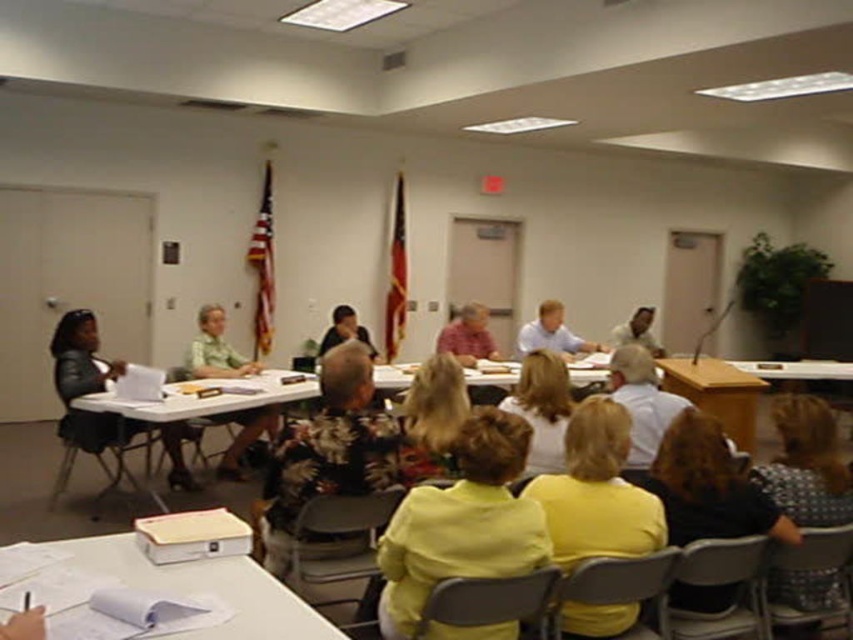
Is matte plastic chair at lower right to the right of blonde hair at center from the viewer's perspective?

Indeed, matte plastic chair at lower right is positioned on the right side of blonde hair at center.

Which is more to the right, matte plastic chair at lower right or blonde hair at center?

From the viewer's perspective, matte plastic chair at lower right appears more on the right side.

This screenshot has width=853, height=640. What are the coordinates of `matte plastic chair at lower right` in the screenshot? It's located at (717, 588).

Between gray plastic chair at lower center and white plastic table at center, which one has more height?

gray plastic chair at lower center is taller.

Can you confirm if gray plastic chair at lower center is bigger than white plastic table at center?

No, gray plastic chair at lower center is not bigger than white plastic table at center.

Where is `gray plastic chair at lower center`? Image resolution: width=853 pixels, height=640 pixels. gray plastic chair at lower center is located at coordinates (341, 556).

From the picture: Who is more forward, (213, 576) or (526, 416)?

Point (213, 576) is more forward.

Can you confirm if white paper at lower left is bigger than light brown hair at center?

No.

Identify the location of white paper at lower left. (206, 588).